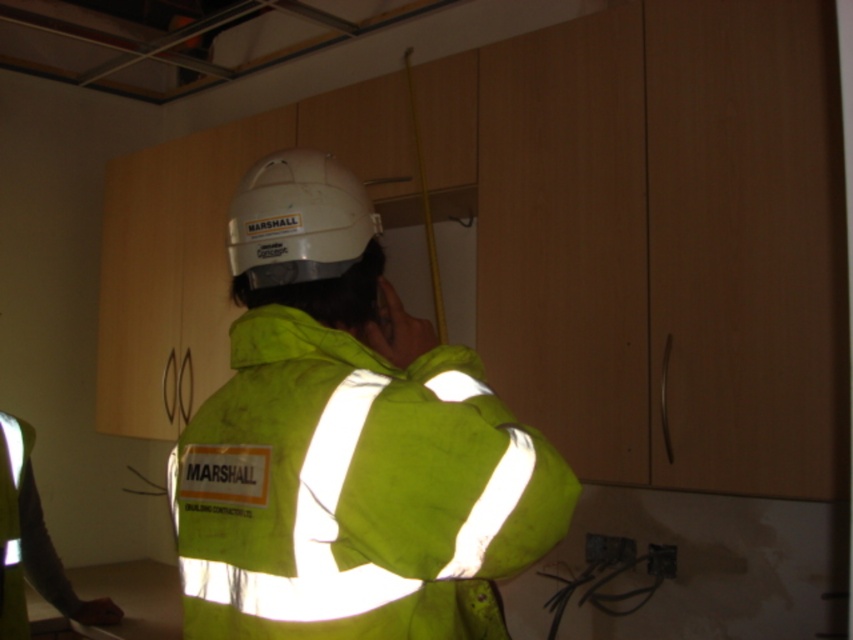
You are standing in the construction site shown in the image. There are two points marked in the scene. The first point is at coordinates point (473,444) and the second is at point (352,186). Which point is closer to you?

Point (473,444) is closer to the viewer than point (352,186).

You are a safety inspector standing 60 inches away from the reflective yellow jacket at center. Can you clearly see the reflective stripes on the jacket from your position?

The reflective yellow jacket at center is 34.28 inches away from the camera, so if you are standing 60 inches away, you are farther than the camera position. Since reflective stripes become less visible with distance, you might not see them as clearly as the camera does.

You are a safety inspector in the construction site. You notice the reflective yellow jacket at center and the white matte helmet at center. According to safety protocols, which item should be worn on top of the other?

The white matte helmet at center should be worn on top of the reflective yellow jacket at center because the jacket is in front of the helmet, indicating proper safety gear layering where the helmet is positioned over the jacket.